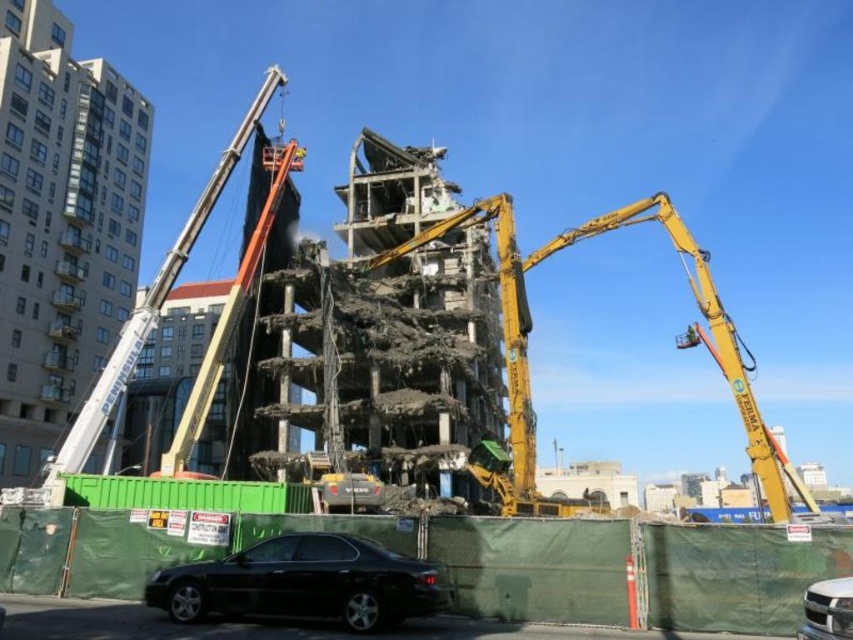
Question: Which point is closer to the camera?

Choices:
 (A) matte black sedan at lower left
 (B) white metal crane at upper left

Answer: (A)

Question: Among these objects, which one is farthest from the camera?

Choices:
 (A) silver metallic suv at lower right
 (B) yellow metallic arm at center

Answer: (B)

Question: From the image, what is the correct spatial relationship of yellow metallic arm at center in relation to matte black sedan at lower left?

Choices:
 (A) above
 (B) below

Answer: (B)

Question: Is yellow metallic arm at center to the right of matte black sedan at lower left from the viewer's perspective?

Choices:
 (A) yes
 (B) no

Answer: (A)

Question: Which of the following is the farthest from the observer?

Choices:
 (A) (152, 316)
 (B) (773, 484)
 (C) (410, 604)

Answer: (A)

Question: Does matte black sedan at lower left have a smaller size compared to white metal crane at upper left?

Choices:
 (A) yes
 (B) no

Answer: (A)